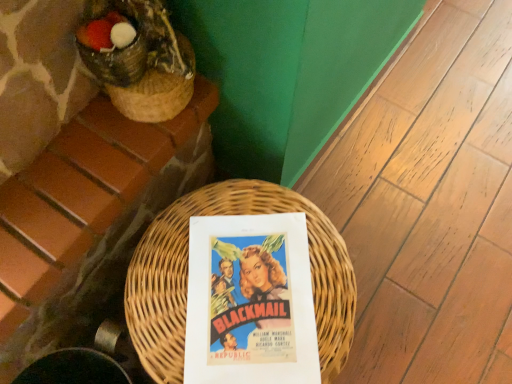
The image size is (512, 384). Find the location of `woven wicker basket at center`. woven wicker basket at center is located at coordinates (186, 275).

The image size is (512, 384). Describe the element at coordinates (186, 275) in the screenshot. I see `woven wicker basket at center` at that location.

The image size is (512, 384). What do you see at coordinates (250, 301) in the screenshot?
I see `matte paper poster at center` at bounding box center [250, 301].

The width and height of the screenshot is (512, 384). Identify the location of matte paper poster at center. (250, 301).

Measure the distance between point (236, 377) and camera.

Point (236, 377) and camera are 66.20 centimeters apart from each other.

The image size is (512, 384). What are the coordinates of `woven wicker basket at center` in the screenshot? It's located at (186, 275).

Does woven wicker basket at center appear on the left side of matte paper poster at center?

Yes, woven wicker basket at center is to the left of matte paper poster at center.

Looking at this image, which object is closer to the camera taking this photo, woven wicker basket at center or matte paper poster at center?

woven wicker basket at center.

Which point is more distant from viewer, [321,328] or [211,375]?

Positioned behind is point [321,328].

From the image's perspective, is woven wicker basket at center below matte paper poster at center?

Yes, from the image's perspective, woven wicker basket at center is beneath matte paper poster at center.

From a real-world perspective, is woven wicker basket at center over matte paper poster at center?

Actually, woven wicker basket at center is physically below matte paper poster at center in the real world.

Which of these two, woven wicker basket at center or matte paper poster at center, is thinner?

With smaller width is matte paper poster at center.

Which of these two, woven wicker basket at center or matte paper poster at center, stands shorter?

Standing shorter between the two is matte paper poster at center.

Considering the sizes of woven wicker basket at center and matte paper poster at center in the image, is woven wicker basket at center bigger or smaller than matte paper poster at center?

Clearly, woven wicker basket at center is larger in size than matte paper poster at center.

Is woven wicker basket at center not within matte paper poster at center?

Yes, woven wicker basket at center is outside of matte paper poster at center.

Is woven wicker basket at center far from matte paper poster at center?

No, woven wicker basket at center is not far from matte paper poster at center.

Is woven wicker basket at center looking in the opposite direction of matte paper poster at center?

That's not correct — woven wicker basket at center is not looking away from matte paper poster at center.

What's the angular difference between woven wicker basket at center and matte paper poster at center's facing directions?

52.4 degrees.

Measure the distance from woven wicker basket at center to matte paper poster at center.

woven wicker basket at center is 1.99 inches away from matte paper poster at center.

The width and height of the screenshot is (512, 384). I want to click on paperback book above the woven wicker basket at center (from a real-world perspective), so click(250, 301).

Visually, is matte paper poster at center positioned to the left or to the right of woven wicker basket at center?

matte paper poster at center is to the right of woven wicker basket at center.

Is matte paper poster at center positioned before woven wicker basket at center?

No, matte paper poster at center is behind woven wicker basket at center.

Which is behind, point (234, 380) or point (178, 342)?

The point (178, 342) is more distant.

From the image's perspective, between matte paper poster at center and woven wicker basket at center, which one is located above?

matte paper poster at center is shown above in the image.

From a real-world perspective, is matte paper poster at center above or below woven wicker basket at center?

matte paper poster at center is above woven wicker basket at center.

Does matte paper poster at center have a lesser width compared to woven wicker basket at center?

Indeed, matte paper poster at center has a lesser width compared to woven wicker basket at center.

Is matte paper poster at center taller than woven wicker basket at center?

A: Incorrect, the height of matte paper poster at center is not larger of that of woven wicker basket at center.

Does matte paper poster at center have a smaller size compared to woven wicker basket at center?

Indeed, matte paper poster at center has a smaller size compared to woven wicker basket at center.

Would you say woven wicker basket at center is part of matte paper poster at center's contents?

No, matte paper poster at center does not contain woven wicker basket at center.

Is matte paper poster at center directly adjacent to woven wicker basket at center?

Absolutely, matte paper poster at center is next to and touching woven wicker basket at center.

Does matte paper poster at center turn towards woven wicker basket at center?

Yes, matte paper poster at center is oriented towards woven wicker basket at center.

How many degrees apart are the facing directions of matte paper poster at center and woven wicker basket at center?

52.4 degrees.

This screenshot has height=384, width=512. In order to click on paperback book positioned vertically above the woven wicker basket at center (from a real-world perspective) in this screenshot , I will do `click(250, 301)`.

In the image, there is a woven wicker basket at center. Where is `paperback book above it (from the image's perspective)`? paperback book above it (from the image's perspective) is located at coordinates (250, 301).

Identify the location of paperback book on the right of woven wicker basket at center. (250, 301).